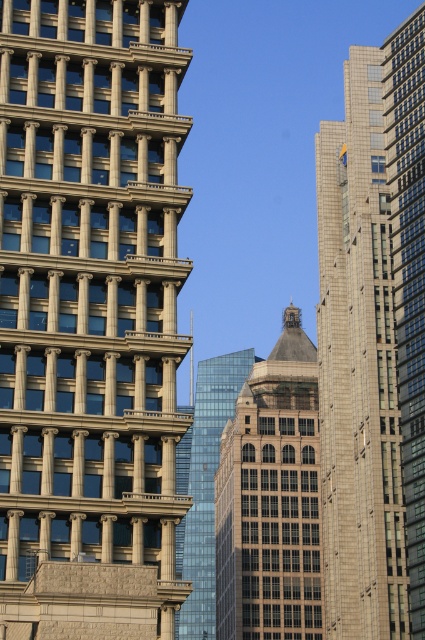
Question: Which of the following is the closest to the observer?

Choices:
 (A) gray stone skyscraper at center
 (B) dark gray glass tower at center
 (C) glassy blue skyscraper at center
 (D) beige stone tower at left

Answer: (D)

Question: Is gray stone skyscraper at center thinner than glassy blue skyscraper at center?

Choices:
 (A) no
 (B) yes

Answer: (B)

Question: Among these objects, which one is nearest to the camera?

Choices:
 (A) dark gray glass tower at center
 (B) beige stone tower at left
 (C) gray stone skyscraper at center
 (D) glassy blue skyscraper at center

Answer: (B)

Question: Is gray stone skyscraper at center closer to camera compared to dark gray glass tower at center?

Choices:
 (A) no
 (B) yes

Answer: (B)

Question: Can you confirm if gray stone skyscraper at center is smaller than dark gray glass tower at center?

Choices:
 (A) yes
 (B) no

Answer: (B)

Question: Which point is closer to the camera taking this photo?

Choices:
 (A) (189, 412)
 (B) (104, 586)

Answer: (B)